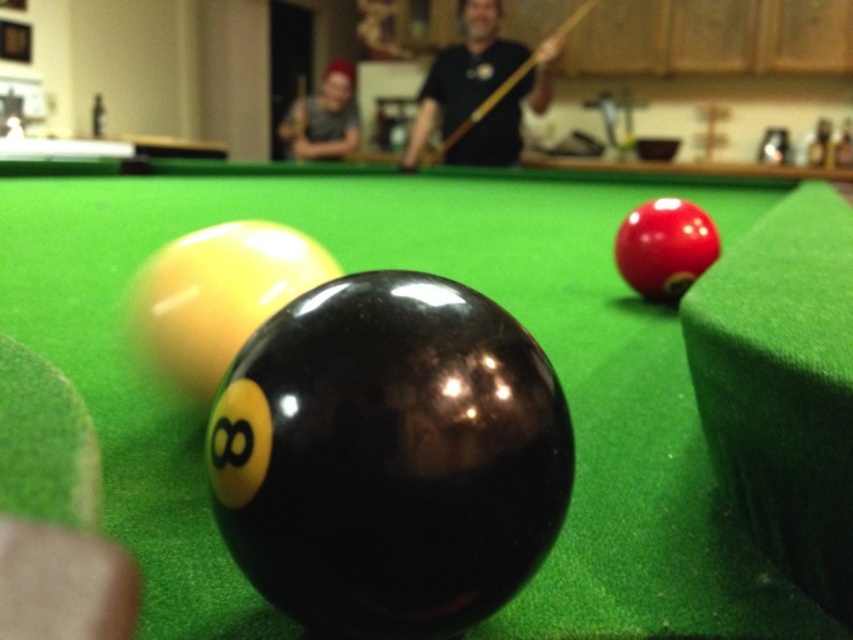
You are a pool player standing at the edge of the table. You notice the matte gray shirt at upper center and the wooden at center. How far apart are these two objects in feet?

The matte gray shirt at upper center is 4.03 feet away from wooden at center.

You are a pool player observing the scene. You notice the matte gray shirt at upper center and the wooden at center. Which object is closer to you?

The matte gray shirt at upper center is closer to you because it is positioned over the wooden at center.